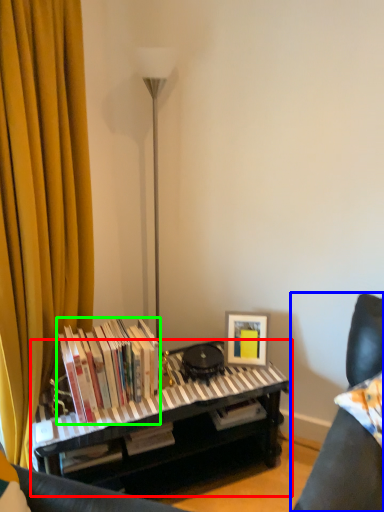
Question: Which object is positioned farthest from piano (highlighted by a red box)? Select from furniture (highlighted by a blue box) and book (highlighted by a green box).

Choices:
 (A) furniture
 (B) book

Answer: (A)